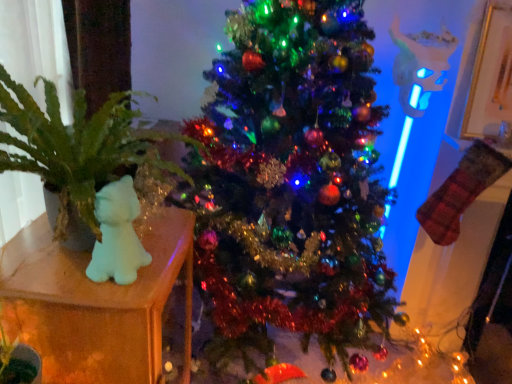
Question: Does green leafy plant at left have a larger size compared to shiny green christmas tree at center?

Choices:
 (A) no
 (B) yes

Answer: (A)

Question: From the image's perspective, is green leafy plant at left on top of shiny green christmas tree at center?

Choices:
 (A) no
 (B) yes

Answer: (B)

Question: Could you tell me if green leafy plant at left is facing shiny green christmas tree at center?

Choices:
 (A) yes
 (B) no

Answer: (B)

Question: Considering the relative sizes of green leafy plant at left and shiny green christmas tree at center in the image provided, is green leafy plant at left taller than shiny green christmas tree at center?

Choices:
 (A) no
 (B) yes

Answer: (A)

Question: Can you confirm if green leafy plant at left is thinner than shiny green christmas tree at center?

Choices:
 (A) no
 (B) yes

Answer: (B)

Question: Is shiny green christmas tree at center in front of or behind green leafy plant at left in the image?

Choices:
 (A) behind
 (B) front

Answer: (A)

Question: From a real-world perspective, relative to green leafy plant at left, is shiny green christmas tree at center vertically above or below?

Choices:
 (A) below
 (B) above

Answer: (A)

Question: Considering the positions of shiny green christmas tree at center and green leafy plant at left in the image, is shiny green christmas tree at center bigger or smaller than green leafy plant at left?

Choices:
 (A) small
 (B) big

Answer: (B)

Question: From the image's perspective, relative to green leafy plant at left, is shiny green christmas tree at center above or below?

Choices:
 (A) below
 (B) above

Answer: (A)

Question: From a real-world perspective, is green leafy plant at left physically located above or below shiny green christmas tree at center?

Choices:
 (A) below
 (B) above

Answer: (B)

Question: Is green leafy plant at left spatially inside shiny green christmas tree at center, or outside of it?

Choices:
 (A) outside
 (B) inside

Answer: (A)

Question: Does point (88, 223) appear closer or farther from the camera than point (321, 319)?

Choices:
 (A) closer
 (B) farther

Answer: (A)

Question: Considering the relative positions of green leafy plant at left and shiny green christmas tree at center in the image provided, is green leafy plant at left to the left or to the right of shiny green christmas tree at center?

Choices:
 (A) left
 (B) right

Answer: (A)

Question: From the image's perspective, is translucent plastic bear at left located above or below green leafy plant at left?

Choices:
 (A) above
 (B) below

Answer: (B)

Question: Is translucent plastic bear at left situated inside green leafy plant at left or outside?

Choices:
 (A) inside
 (B) outside

Answer: (B)